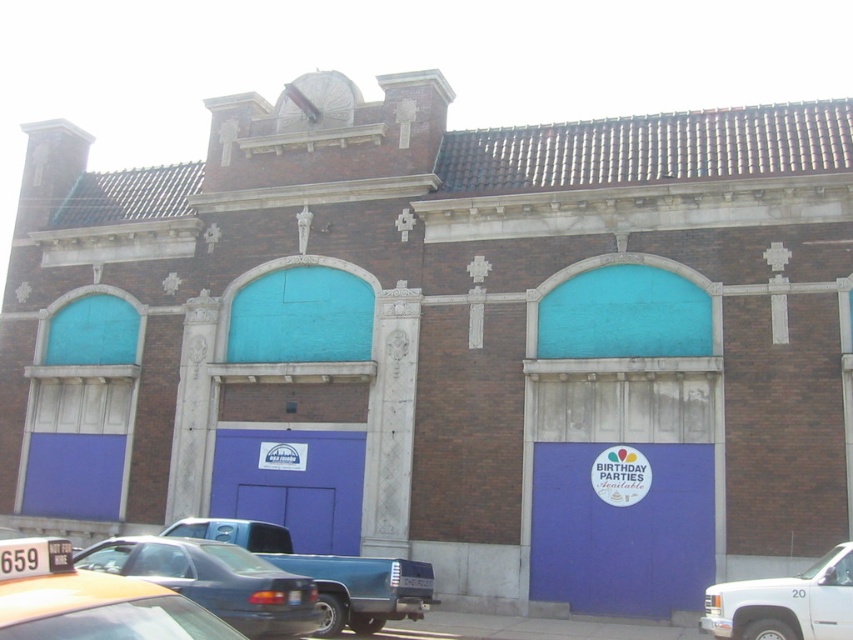
You are a delivery driver who needs to park your white matte truck at lower right near the blue matte garage door at lower right. Given that the garage door is smaller than the truck, will the truck fit inside the garage?

The blue matte garage door at lower right has a smaller size compared to white matte truck at lower right, so the truck will not fit inside the garage.

You are standing at the entrance of the building and want to locate the blue matte garage door at lower right. According to the coordinates provided, where should you look relative to the central arch?

The blue matte garage door at lower right is located at coordinates point (621, 525), which is to the right and slightly below the central arch.

You are driving a car that is 15 feet long. You want to park your car between the blue matte garage door at center and the metallic blue truck at lower center. Is there enough space between them to park your car?

The blue matte garage door at center and metallic blue truck at lower center are 12.62 feet apart from each other. Since your car is 15 feet long, which is longer than the available space, you cannot park your car between them.